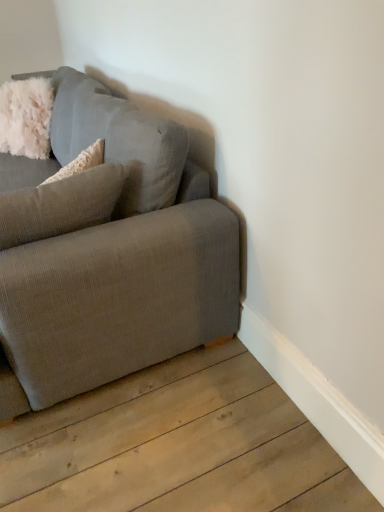
Question: Considering the relative sizes of textured gray couch at left and fluffy white pillow at left in the image provided, is textured gray couch at left bigger than fluffy white pillow at left?

Choices:
 (A) no
 (B) yes

Answer: (B)

Question: Is textured gray couch at left facing away from fluffy white pillow at left?

Choices:
 (A) no
 (B) yes

Answer: (B)

Question: Does textured gray couch at left turn towards fluffy white pillow at left?

Choices:
 (A) yes
 (B) no

Answer: (A)

Question: Is there a large distance between textured gray couch at left and fluffy white pillow at left?

Choices:
 (A) no
 (B) yes

Answer: (A)

Question: Is fluffy white pillow at left a part of textured gray couch at left?

Choices:
 (A) no
 (B) yes

Answer: (B)

Question: Does textured gray couch at left have a smaller size compared to fluffy white pillow at left?

Choices:
 (A) no
 (B) yes

Answer: (A)

Question: Would you consider fluffy white pillow at left to be distant from textured gray couch at left?

Choices:
 (A) yes
 (B) no

Answer: (B)

Question: Is fluffy white pillow at left facing away from textured gray couch at left?

Choices:
 (A) yes
 (B) no

Answer: (A)

Question: Considering the relative positions of fluffy white pillow at left and textured gray couch at left in the image provided, is fluffy white pillow at left to the left of textured gray couch at left from the viewer's perspective?

Choices:
 (A) no
 (B) yes

Answer: (A)

Question: From a real-world perspective, does fluffy white pillow at left sit lower than textured gray couch at left?

Choices:
 (A) no
 (B) yes

Answer: (A)

Question: Can you confirm if fluffy white pillow at left is shorter than textured gray couch at left?

Choices:
 (A) no
 (B) yes

Answer: (B)

Question: Does fluffy white pillow at left turn towards textured gray couch at left?

Choices:
 (A) yes
 (B) no

Answer: (A)

Question: Considering the positions of textured gray couch at left and fluffy white pillow at left in the image, is textured gray couch at left bigger or smaller than fluffy white pillow at left?

Choices:
 (A) big
 (B) small

Answer: (A)